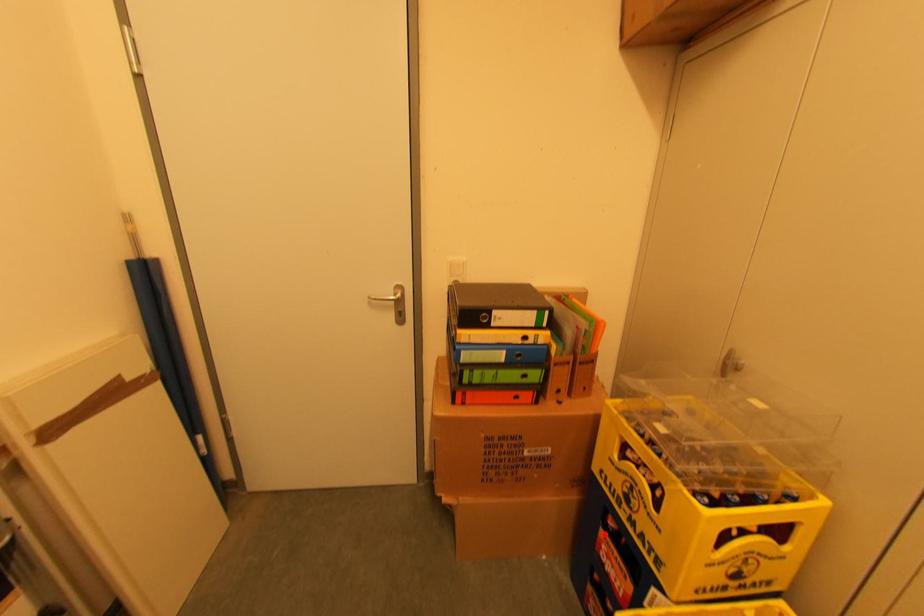
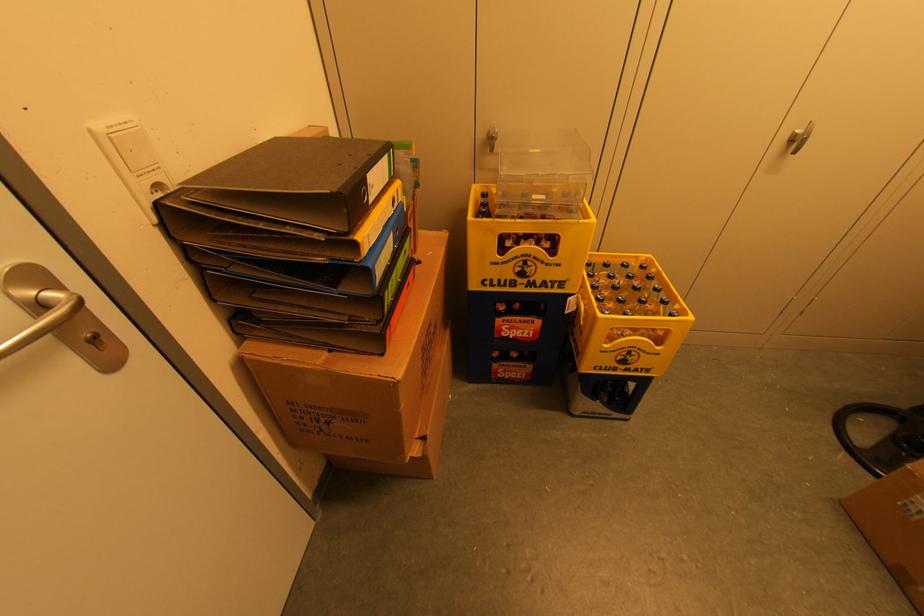
Find the pixel in the second image that matches the highlighted location in the first image.

(501, 322)